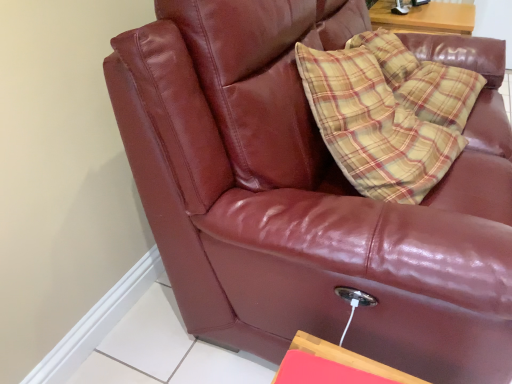
This screenshot has width=512, height=384. What are the coordinates of `wooden at lower right` in the screenshot? It's located at (333, 365).

Based on the photo, what is the approximate height of wooden at lower right?

It is 2.46 centimeters.

The width and height of the screenshot is (512, 384). What do you see at coordinates (333, 365) in the screenshot?
I see `wooden at lower right` at bounding box center [333, 365].

Identify the location of wooden at lower right. Image resolution: width=512 pixels, height=384 pixels. (333, 365).